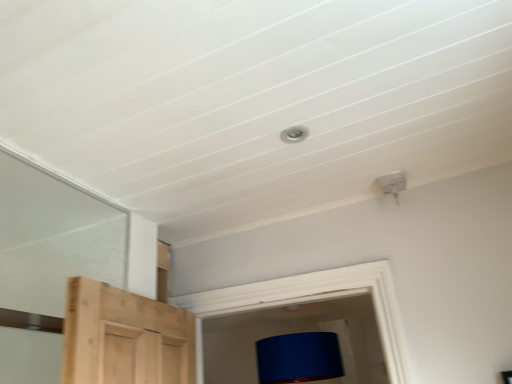
This screenshot has width=512, height=384. Describe the element at coordinates (392, 184) in the screenshot. I see `white plastic plug at upper right` at that location.

Identify the location of white plastic plug at upper right. (392, 184).

Where is `white plastic plug at upper right`? This screenshot has height=384, width=512. white plastic plug at upper right is located at coordinates (392, 184).